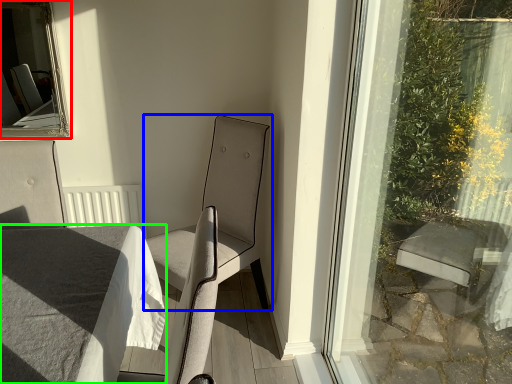
Question: Which is farther away from bay window (highlighted by a red box)? chair (highlighted by a blue box) or table (highlighted by a green box)?

Choices:
 (A) chair
 (B) table

Answer: (B)